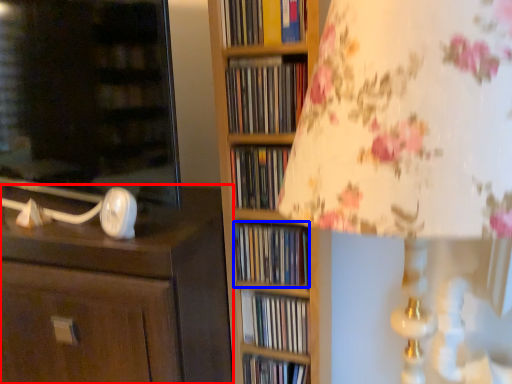
Question: Which object appears farthest to the camera in this image, chest of drawers (highlighted by a red box) or book (highlighted by a blue box)?

Choices:
 (A) chest of drawers
 (B) book

Answer: (B)